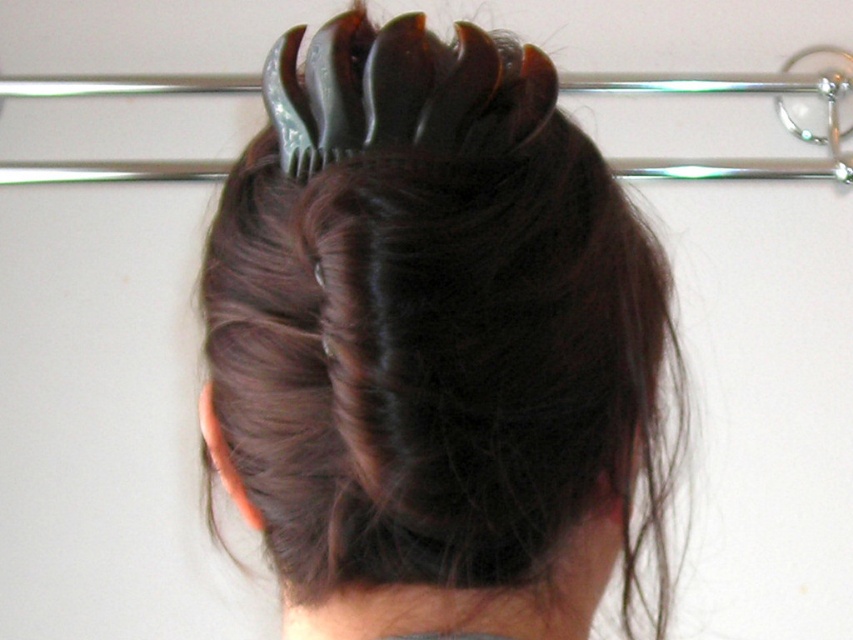
Does dark brown glossy hair clip at center lie in front of black plastic hair clip at upper center?

That is True.

Where is `dark brown glossy hair clip at center`? This screenshot has width=853, height=640. dark brown glossy hair clip at center is located at coordinates (433, 342).

The image size is (853, 640). What do you see at coordinates (433, 342) in the screenshot?
I see `dark brown glossy hair clip at center` at bounding box center [433, 342].

Find the location of `dark brown glossy hair clip at center`. dark brown glossy hair clip at center is located at coordinates (433, 342).